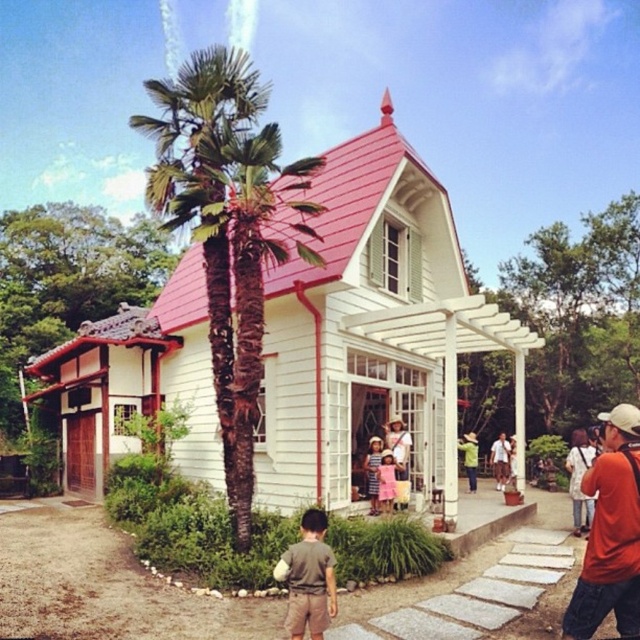
Is white wood house at center shorter than matte white hut at left?

Incorrect, white wood house at center's height does not fall short of matte white hut at left's.

Between point (294, 465) and point (81, 445), which one is positioned in front?

Positioned in front is point (294, 465).

What do you see at coordinates (372, 330) in the screenshot?
I see `white wood house at center` at bounding box center [372, 330].

You are a GUI agent. You are given a task and a screenshot of the screen. Output one action in this format:
    pyautogui.click(x=<x>, y=<y>)
    Task: Click on the white wood house at center
    The width and height of the screenshot is (640, 640).
    Given the screenshot: What is the action you would take?
    pyautogui.click(x=372, y=330)

Does green leafy palm tree at left have a lesser width compared to striped fabric dress at center?

No, green leafy palm tree at left is not thinner than striped fabric dress at center.

Which of these two, green leafy palm tree at left or striped fabric dress at center, stands shorter?

striped fabric dress at center

Between point (241, 236) and point (365, 468), which one is positioned behind?

Positioned behind is point (365, 468).

Identify the location of green leafy palm tree at left. (225, 228).

Who is taller, brown cotton shirt at lower center or striped fabric dress at center?

Standing taller between the two is striped fabric dress at center.

In the scene shown: Measure the distance between point (300, 582) and camera.

They are 6.34 meters apart.

Locate an element on the screen. The height and width of the screenshot is (640, 640). brown cotton shirt at lower center is located at coordinates (308, 577).